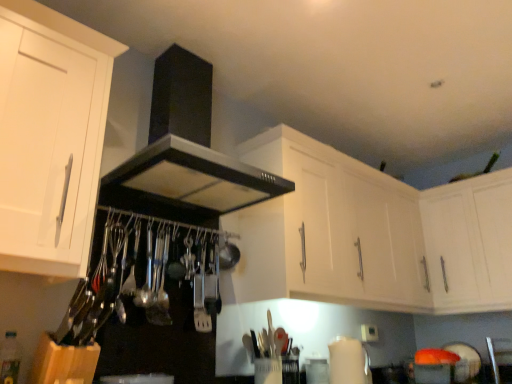
Question: Is white matte cabinet at upper right, which appears as the 3th cabinetry when viewed from the left, positioned with its back to satin nickel spatula at center?

Choices:
 (A) no
 (B) yes

Answer: (A)

Question: Is white matte cabinet at upper right, the first cabinetry from the right, to the left of satin nickel spatula at center from the viewer's perspective?

Choices:
 (A) no
 (B) yes

Answer: (A)

Question: From the image's perspective, would you say white matte cabinet at upper right, which appears as the 3th cabinetry when viewed from the left, is positioned over satin nickel spatula at center?

Choices:
 (A) no
 (B) yes

Answer: (B)

Question: Can you confirm if white matte cabinet at upper right, the first cabinetry from the right, is bigger than satin nickel spatula at center?

Choices:
 (A) yes
 (B) no

Answer: (A)

Question: Can satin nickel spatula at center be found inside white matte cabinet at upper right, which appears as the 3th cabinetry when viewed from the left?

Choices:
 (A) yes
 (B) no

Answer: (B)

Question: From a real-world perspective, is white matte cabinet at upper right, the first cabinetry from the right, physically located above or below white matte cabinet at upper center, marked as the 2th cabinetry in a left-to-right arrangement?

Choices:
 (A) above
 (B) below

Answer: (B)

Question: From the image's perspective, is white matte cabinet at upper right, the first cabinetry from the right, above or below white matte cabinet at upper center, marked as the 2th cabinetry in a left-to-right arrangement?

Choices:
 (A) below
 (B) above

Answer: (A)

Question: Is white matte cabinet at upper right, the first cabinetry from the right, taller or shorter than white matte cabinet at upper center, placed as the second cabinetry when sorted from right to left?

Choices:
 (A) short
 (B) tall

Answer: (A)

Question: Looking at their shapes, would you say white matte cabinet at upper right, which appears as the 3th cabinetry when viewed from the left, is wider or thinner than white matte cabinet at upper center, marked as the 2th cabinetry in a left-to-right arrangement?

Choices:
 (A) wide
 (B) thin

Answer: (A)

Question: Considering the positions of point (439, 238) and point (169, 119), is point (439, 238) closer or farther from the camera than point (169, 119)?

Choices:
 (A) farther
 (B) closer

Answer: (A)

Question: Considering the positions of white matte cabinet at upper right, which appears as the 3th cabinetry when viewed from the left, and black matte exhaust hood at upper center in the image, is white matte cabinet at upper right, which appears as the 3th cabinetry when viewed from the left, bigger or smaller than black matte exhaust hood at upper center?

Choices:
 (A) small
 (B) big

Answer: (A)

Question: Based on their positions, is white matte cabinet at upper right, which appears as the 3th cabinetry when viewed from the left, located to the left or right of black matte exhaust hood at upper center?

Choices:
 (A) right
 (B) left

Answer: (A)

Question: Considering their positions, is white matte cabinet at upper right, which appears as the 3th cabinetry when viewed from the left, located in front of or behind black matte exhaust hood at upper center?

Choices:
 (A) front
 (B) behind

Answer: (B)

Question: Considering the positions of white matte cabinet at upper right, the first cabinetry from the right, and white matte cabinet at left, the 3th cabinetry from the right, in the image, is white matte cabinet at upper right, the first cabinetry from the right, taller or shorter than white matte cabinet at left, the 3th cabinetry from the right,?

Choices:
 (A) tall
 (B) short

Answer: (B)

Question: From the image's perspective, is white matte cabinet at upper right, which appears as the 3th cabinetry when viewed from the left, positioned above or below white matte cabinet at left, which ranks as the first cabinetry in left-to-right order?

Choices:
 (A) below
 (B) above

Answer: (A)